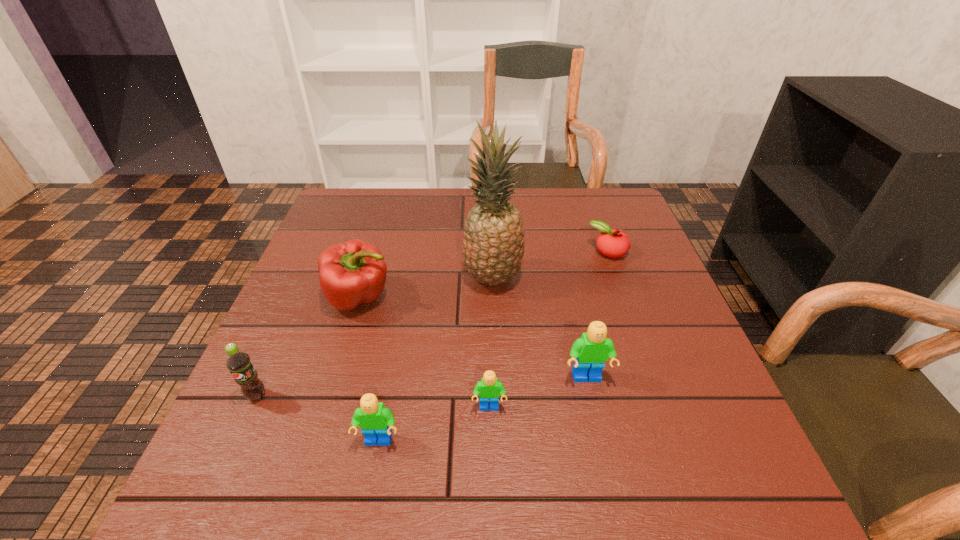
Identify the location of soda. (238, 362).

This screenshot has width=960, height=540. Find the location of `free space located 0.110m on the face of the tallest Lego`. free space located 0.110m on the face of the tallest Lego is located at coordinates (601, 441).

Identify the location of free space located on the right of the tallest object. Image resolution: width=960 pixels, height=540 pixels. (651, 279).

Where is `vacant space positioned on the back of the apple`? The image size is (960, 540). vacant space positioned on the back of the apple is located at coordinates (594, 214).

Where is `free space located 0.120m on the back of the bell pepper`? free space located 0.120m on the back of the bell pepper is located at coordinates (374, 247).

Locate an element on the screen. free space located 0.080m on the front label of the leftmost object is located at coordinates (235, 445).

Identify the location of soda present at the near edge. This screenshot has width=960, height=540. (238, 362).

Locate an element on the screen. The height and width of the screenshot is (540, 960). bell pepper present at the left edge is located at coordinates (354, 272).

At what (x,y) coordinates should I click in order to perform the action: click on soda at the left edge. Please return your answer as a coordinate pair (x, y). The image size is (960, 540). Looking at the image, I should click on (238, 362).

The height and width of the screenshot is (540, 960). I want to click on object situated at the right edge, so click(x=612, y=243).